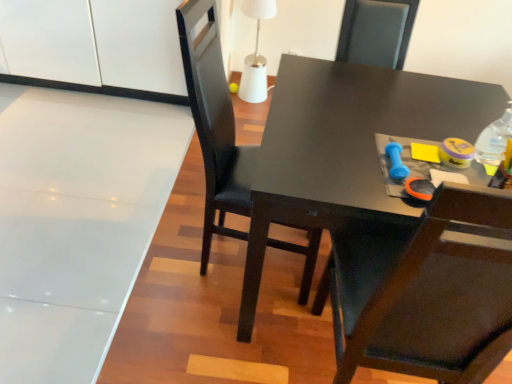
Question: Is matte black table at center to the left or to the right of matte black chair at center in the image?

Choices:
 (A) left
 (B) right

Answer: (B)

Question: Do you think matte black table at center is within matte black chair at center, or outside of it?

Choices:
 (A) inside
 (B) outside

Answer: (B)

Question: Based on their relative distances, which object is farther from the transparent plastic bottle at upper right?

Choices:
 (A) matte black chair at center
 (B) matte black table at center
 (C) white glossy cabinet at upper left
 (D) blue rubber dumbbell at upper right

Answer: (C)

Question: Estimate the real-world distances between objects in this image. Which object is farther from the blue rubber dumbbell at upper right?

Choices:
 (A) matte black chair at center
 (B) transparent plastic bottle at upper right
 (C) white glossy cabinet at upper left
 (D) matte black table at center

Answer: (C)